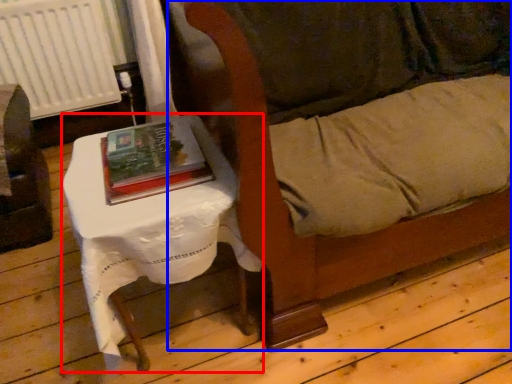
Question: Which of the following is the closest to the observer, table (highlighted by a red box) or couch (highlighted by a blue box)?

Choices:
 (A) table
 (B) couch

Answer: (B)